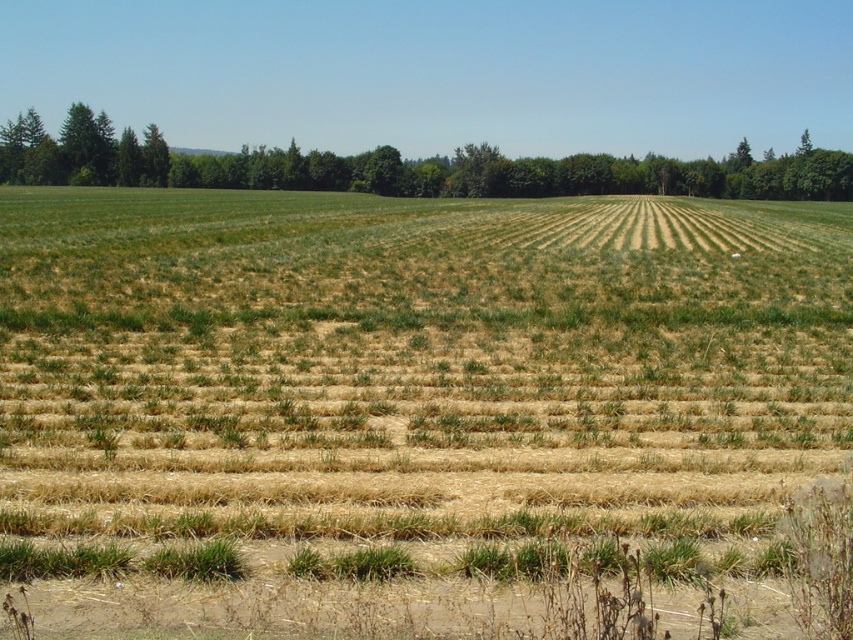
How distant is green grass at center from green leafy tree at upper left?

green grass at center and green leafy tree at upper left are 101.79 meters apart.

Which is below, green grass at center or green leafy tree at upper left?

Positioned lower is green grass at center.

Which is in front, point (561, 321) or point (393, 164)?

Point (561, 321) is in front.

Where is `green grass at center`? This screenshot has width=853, height=640. green grass at center is located at coordinates (407, 404).